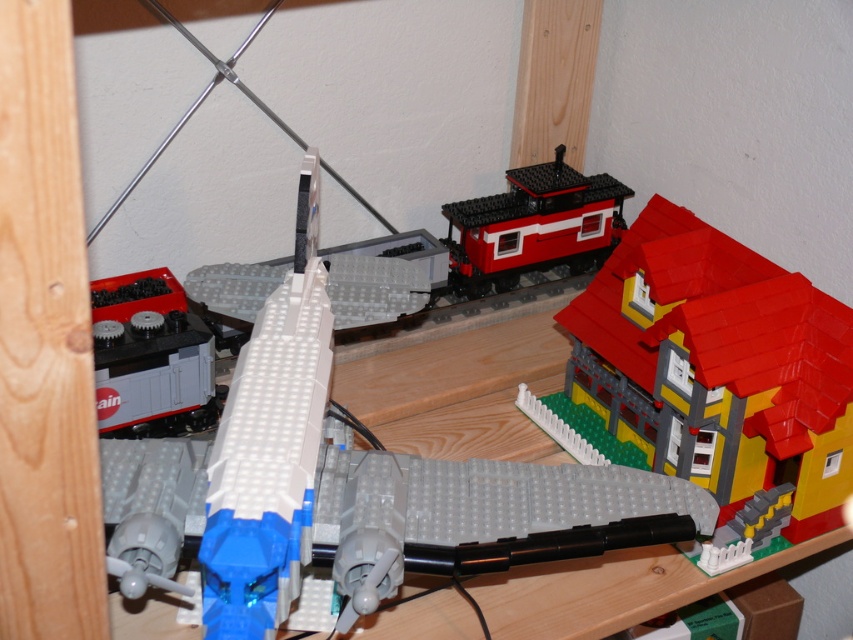
Is white plastic train car at center bigger than matte black train car at center?

Yes, white plastic train car at center is bigger than matte black train car at center.

You are a GUI agent. You are given a task and a screenshot of the screen. Output one action in this format:
    pyautogui.click(x=<x>, y=<y>)
    Task: Click on the white plastic train car at center
    This screenshot has width=853, height=640.
    Given the screenshot: What is the action you would take?
    pyautogui.click(x=346, y=486)

Is point (299, 260) positioned before point (646, 451)?

Yes, point (299, 260) is in front of point (646, 451).

Does white plastic train car at center have a lesser width compared to yellow matte house at center right?

Incorrect, white plastic train car at center's width is not less than yellow matte house at center right's.

What are the coordinates of `white plastic train car at center` in the screenshot? It's located at (346, 486).

Can you confirm if smooth plastic train car at center is thinner than matte black train car at center?

Incorrect, smooth plastic train car at center's width is not less than matte black train car at center's.

Is smooth plastic train car at center shorter than matte black train car at center?

No, smooth plastic train car at center is not shorter than matte black train car at center.

Identify the location of smooth plastic train car at center. (532, 227).